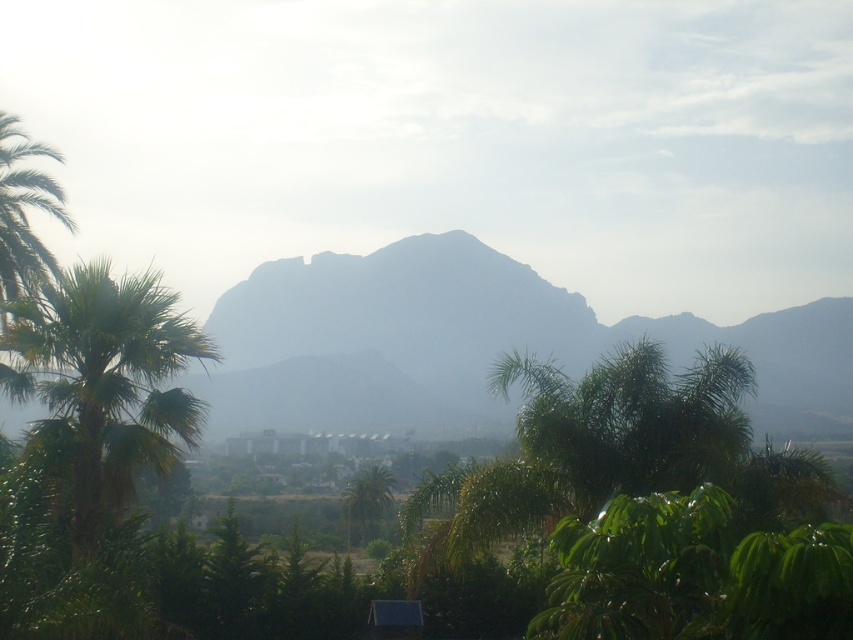
Is green leafy palm at left smaller than green leafy palm tree at center?

Yes, green leafy palm at left is smaller than green leafy palm tree at center.

In order to click on green leafy palm at left in this screenshot , I will do `click(103, 385)`.

Measure the distance between smokey gray mountain at center and green leafy palm at left.

smokey gray mountain at center is 46.42 meters away from green leafy palm at left.

Which is in front, point (297, 320) or point (102, 445)?

Positioned in front is point (102, 445).

Locate an element on the screen. The height and width of the screenshot is (640, 853). smokey gray mountain at center is located at coordinates (469, 342).

Is smokey gray mountain at center positioned behind green leafy palm tree at center?

No, it is in front of green leafy palm tree at center.

Describe the element at coordinates (469, 342) in the screenshot. I see `smokey gray mountain at center` at that location.

Measure the distance between smokey gray mountain at center and camera.

The distance of smokey gray mountain at center from camera is 61.60 feet.

Identify the location of smokey gray mountain at center. This screenshot has width=853, height=640. (469, 342).